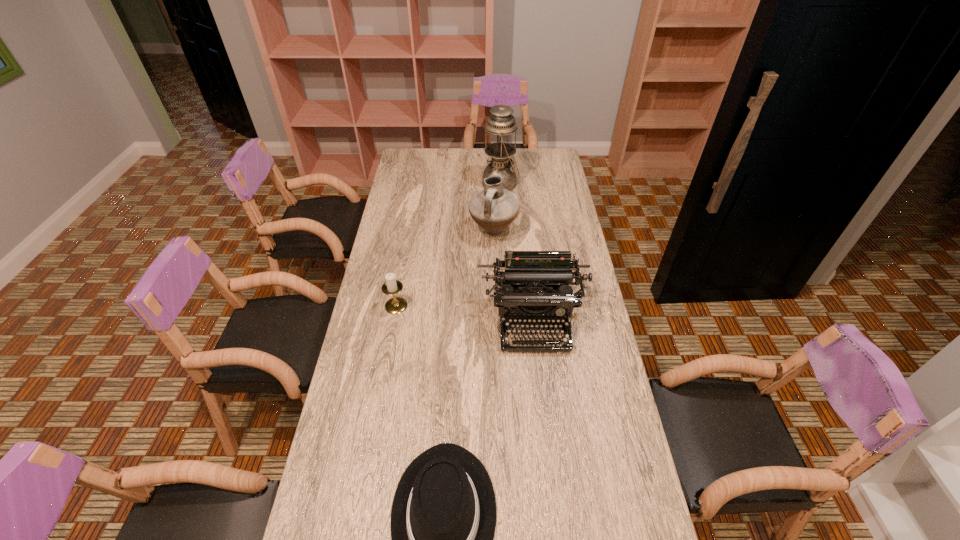
Find the location of `object at the left edge`. object at the left edge is located at coordinates (395, 305).

Find the location of a particular element. This screenshot has height=540, width=960. object that is at the right edge is located at coordinates (534, 282).

The image size is (960, 540). I want to click on vacant space at the far edge, so click(x=516, y=167).

Locate an element on the screen. Image resolution: width=960 pixels, height=540 pixels. vacant space at the left edge of the desktop is located at coordinates (356, 511).

Identify the location of free region at the right edge. This screenshot has height=540, width=960. (587, 366).

The height and width of the screenshot is (540, 960). In order to click on vacant space at the far left corner of the desktop in this screenshot , I will do `click(431, 167)`.

This screenshot has width=960, height=540. Find the location of `vacant region between the candle holder and the fourth nearest object`. vacant region between the candle holder and the fourth nearest object is located at coordinates (444, 268).

Identify the location of vacant area between the fourth tallest object and the tallest object. (448, 245).

Locate an element on the screen. Image resolution: width=960 pixels, height=540 pixels. free spot between the fourth tallest object and the oil lamp is located at coordinates (448, 245).

At what (x,y) coordinates should I click in order to perform the action: click on free area in between the fourth nearest object and the candle holder. Please return your answer as a coordinate pair (x, y). Looking at the image, I should click on (444, 268).